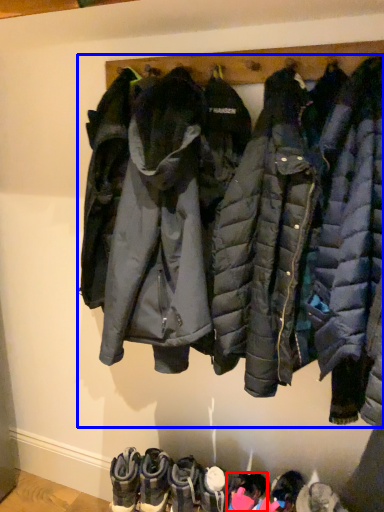
Question: Which point is further to the camera, footwear (highlighted by a red box) or jacket (highlighted by a blue box)?

Choices:
 (A) footwear
 (B) jacket

Answer: (A)